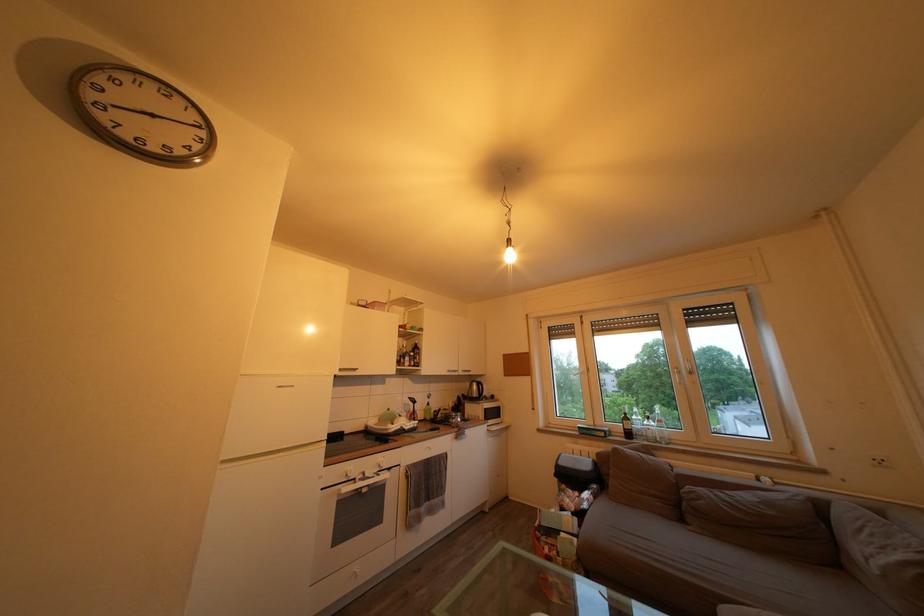
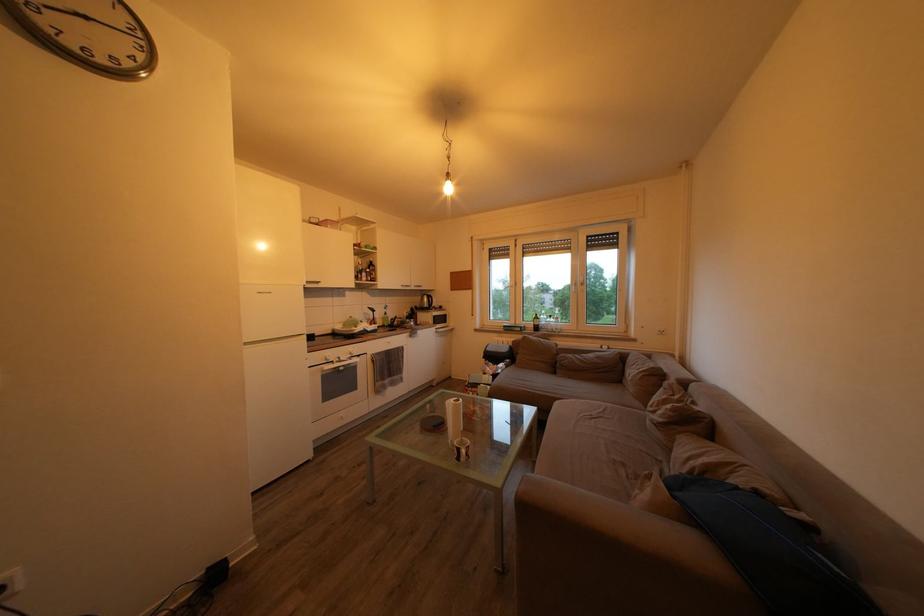
Where in the second image is the point corresponding to point 590,329 from the first image?

(524, 252)